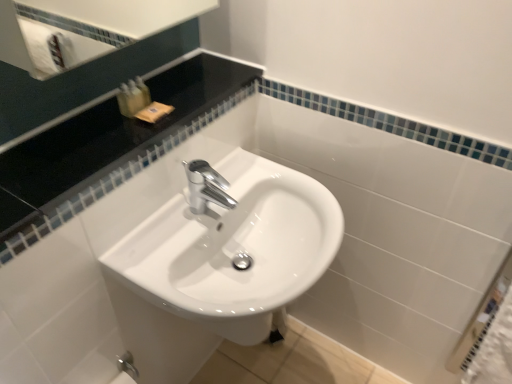
Question: Does translucent plastic soap at upper left, which is counted as the third toiletry, starting from the left, have a greater height compared to white glossy sink at center?

Choices:
 (A) yes
 (B) no

Answer: (B)

Question: Is translucent plastic soap at upper left, which is the 1th toiletry in right-to-left order, at the left side of white glossy sink at center?

Choices:
 (A) yes
 (B) no

Answer: (A)

Question: From the image's perspective, is translucent plastic soap at upper left, which is the 1th toiletry in right-to-left order, beneath white glossy sink at center?

Choices:
 (A) no
 (B) yes

Answer: (A)

Question: Is translucent plastic soap at upper left, which is the 1th toiletry in right-to-left order, to the right of white glossy sink at center from the viewer's perspective?

Choices:
 (A) no
 (B) yes

Answer: (A)

Question: Does translucent plastic soap at upper left, which is counted as the third toiletry, starting from the left, have a greater width compared to white glossy sink at center?

Choices:
 (A) yes
 (B) no

Answer: (B)

Question: Is translucent plastic soap dispenser at upper left, which is counted as the 2th toiletry, starting from the left, bigger or smaller than black glossy countertop at upper left?

Choices:
 (A) big
 (B) small

Answer: (B)

Question: Is point (130, 112) closer or farther from the camera than point (160, 100)?

Choices:
 (A) closer
 (B) farther

Answer: (A)

Question: From a real-world perspective, is translucent plastic soap dispenser at upper left, positioned as the 2th toiletry in right-to-left order, positioned above or below black glossy countertop at upper left?

Choices:
 (A) below
 (B) above

Answer: (B)

Question: From the image's perspective, is translucent plastic soap dispenser at upper left, positioned as the 2th toiletry in right-to-left order, positioned above or below black glossy countertop at upper left?

Choices:
 (A) above
 (B) below

Answer: (A)

Question: Is polished chrome tap at center to the left or to the right of black glossy countertop at upper left in the image?

Choices:
 (A) right
 (B) left

Answer: (A)

Question: Does point [197, 203] appear closer or farther from the camera than point [84, 163]?

Choices:
 (A) closer
 (B) farther

Answer: (B)

Question: From a real-world perspective, relative to black glossy countertop at upper left, is polished chrome tap at center vertically above or below?

Choices:
 (A) above
 (B) below

Answer: (B)

Question: Is polished chrome tap at center wider or thinner than black glossy countertop at upper left?

Choices:
 (A) wide
 (B) thin

Answer: (B)

Question: In terms of size, does black glossy countertop at upper left appear bigger or smaller than polished chrome tap at center?

Choices:
 (A) big
 (B) small

Answer: (A)

Question: From a real-world perspective, is black glossy countertop at upper left physically located above or below polished chrome tap at center?

Choices:
 (A) above
 (B) below

Answer: (A)